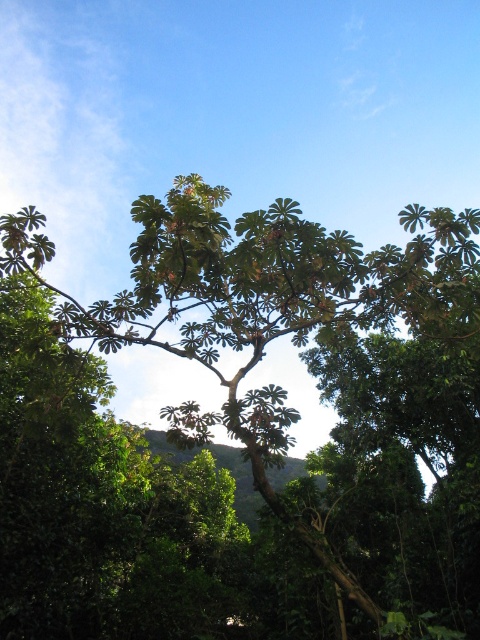
Looking at this image, you are standing in the forest and see the green leafy tree at center and the green leafy hillside at center. Which one is positioned to the right?

The green leafy tree at center is to the right of the green leafy hillside at center.

Based on the photo, you are a hiker standing in the forest and want to take a photo of both the green leafy tree at center and the green leafy hillside at center. Which one should you zoom in on to ensure both fit in the frame?

Since the green leafy tree at center is wider than the green leafy hillside at center, you should zoom out to capture both in the frame. Zooming in might cause the wider tree to be cut off.